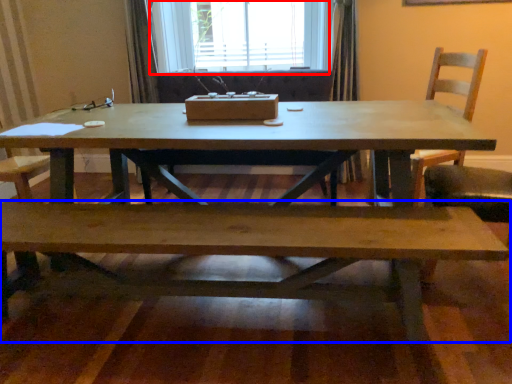
Question: Which point is further to the camera, window (highlighted by a red box) or bench (highlighted by a blue box)?

Choices:
 (A) window
 (B) bench

Answer: (A)